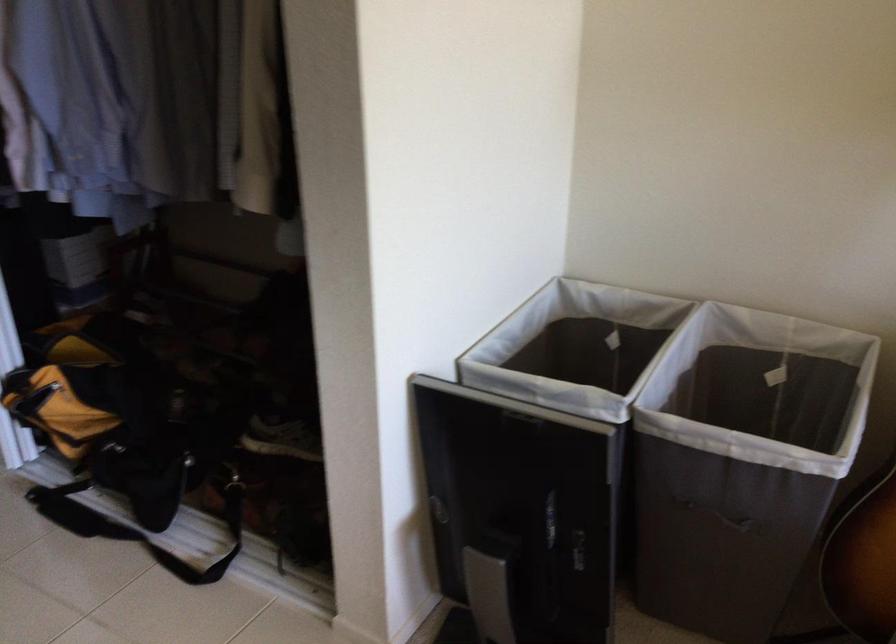
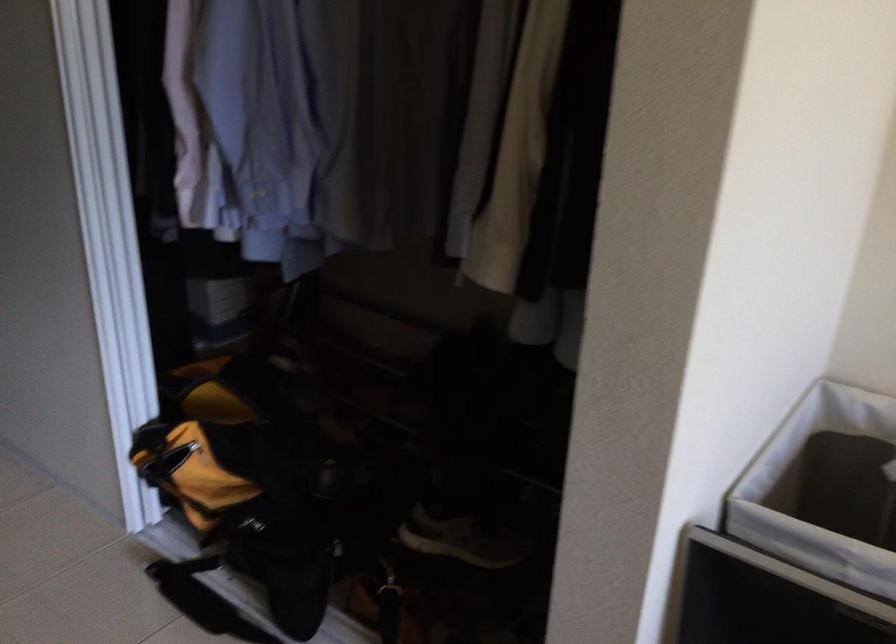
In the second image, find the point that corresponds to point (117, 446) in the first image.

(253, 525)